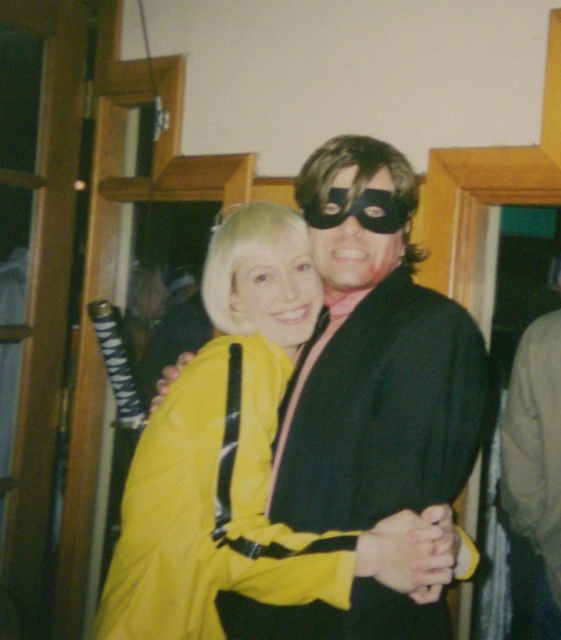
You are a security guard checking the entrance. You notice two items in the image that need to be inspected for prohibited materials. The items are the brown suede jacket at right and the black matte mask at center. Based on their positions, which item is closer to the floor?

The brown suede jacket at right is located below the black matte mask at center, so the jacket is closer to the floor.

You are standing in the room and want to place a small plant between the two points, point 1 at (519, 513) and point 2 at (278, 336). Considering their positions, which point should the plant be closer to so it doesn,t block the view of the person at point 2?

The plant should be placed closer to point 2 at (278, 336) because point 1 at (519, 513) is behind point 2, so placing it near point 2 would avoid blocking the view of the person at point 2.

You are a costume designer preparing for a play. You need to arrange the brown suede jacket at right and the yellow matte jacket at center on a rack. Based on the image, which jacket should be placed higher on the rack?

The yellow matte jacket at center should be placed higher on the rack since the brown suede jacket at right is located below it in the image.